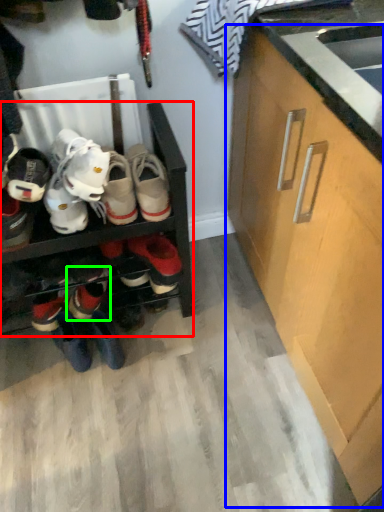
Question: Which is nearer to the shelf (highlighted by a red box)? cabinetry (highlighted by a blue box) or footwear (highlighted by a green box).

Choices:
 (A) cabinetry
 (B) footwear

Answer: (B)